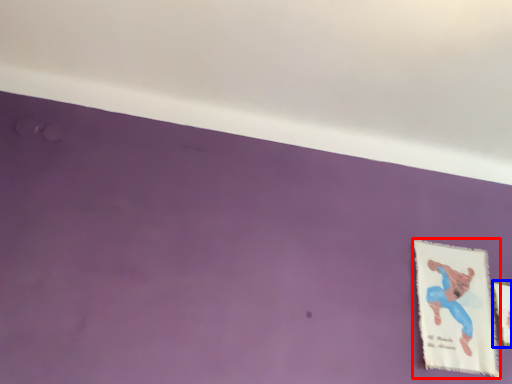
Question: Which point is further to the camera, picture frame (highlighted by a red box) or picture frame (highlighted by a blue box)?

Choices:
 (A) picture frame
 (B) picture frame

Answer: (B)